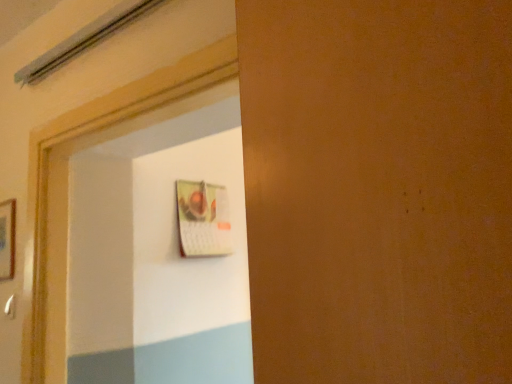
Question: From a real-world perspective, is white plastic door handle at lower left positioned above or below wooden picture frame at left?

Choices:
 (A) below
 (B) above

Answer: (A)

Question: Is white plastic door handle at lower left taller or shorter than wooden picture frame at left?

Choices:
 (A) tall
 (B) short

Answer: (B)

Question: Is white plastic door handle at lower left inside or outside of wooden picture frame at left?

Choices:
 (A) outside
 (B) inside

Answer: (A)

Question: From the image's perspective, is wooden picture frame at left above or below white plastic door handle at lower left?

Choices:
 (A) above
 (B) below

Answer: (A)

Question: In terms of width, does wooden picture frame at left look wider or thinner when compared to white plastic door handle at lower left?

Choices:
 (A) wide
 (B) thin

Answer: (A)

Question: In terms of height, does wooden picture frame at left look taller or shorter compared to white plastic door handle at lower left?

Choices:
 (A) tall
 (B) short

Answer: (A)

Question: Is point (5, 236) closer or farther from the camera than point (12, 296)?

Choices:
 (A) closer
 (B) farther

Answer: (B)